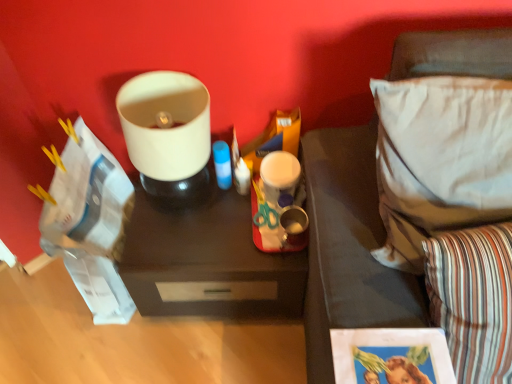
At what (x,y) coordinates should I click in order to perform the action: click on vacant point above dark wood tray at center (from a real-world perspective). Please return your answer as a coordinate pair (x, y). This screenshot has height=384, width=512. Looking at the image, I should click on (212, 223).